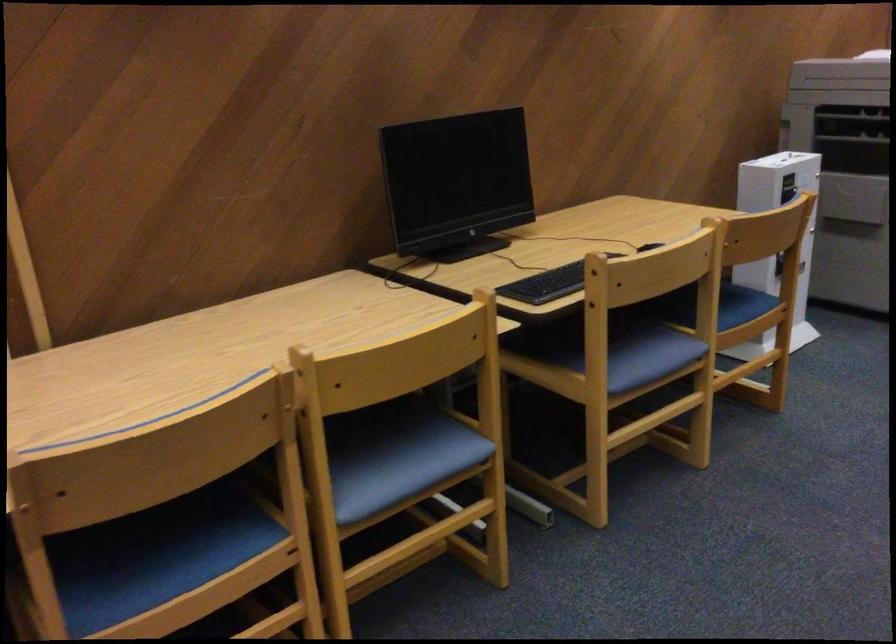
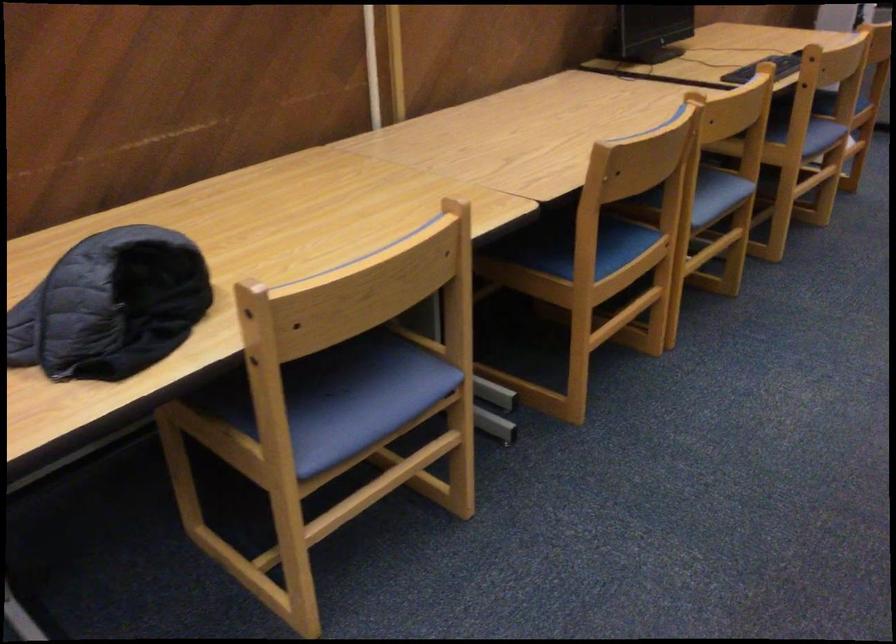
The point at (649,371) is marked in the first image. Where is the corresponding point in the second image?

(821, 136)